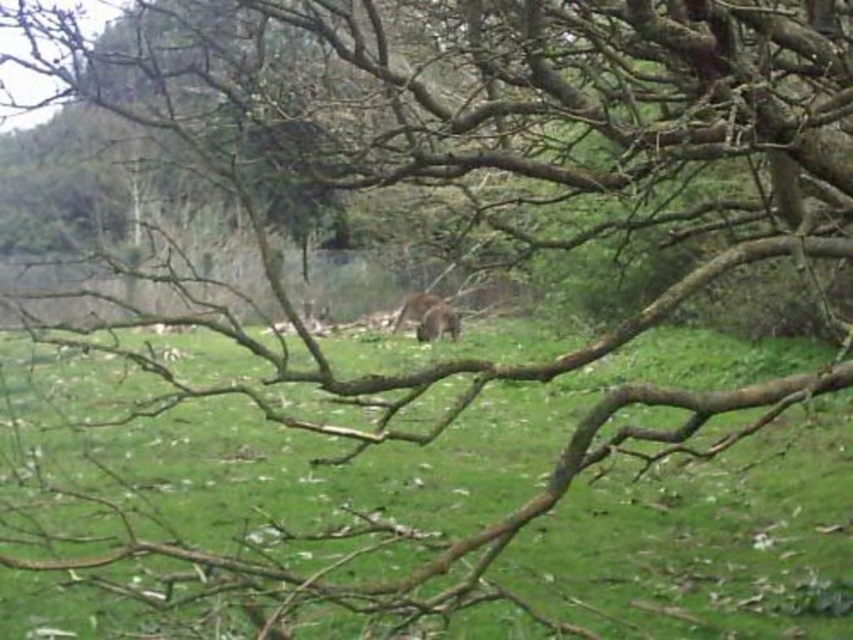
Who is taller, green grassy field at center or brown furry animal at center?

brown furry animal at center

This screenshot has width=853, height=640. Describe the element at coordinates (425, 504) in the screenshot. I see `green grassy field at center` at that location.

Between point (335, 636) and point (422, 316), which one is positioned in front?

Point (335, 636) is more forward.

Where is `green grassy field at center`? The image size is (853, 640). green grassy field at center is located at coordinates (425, 504).